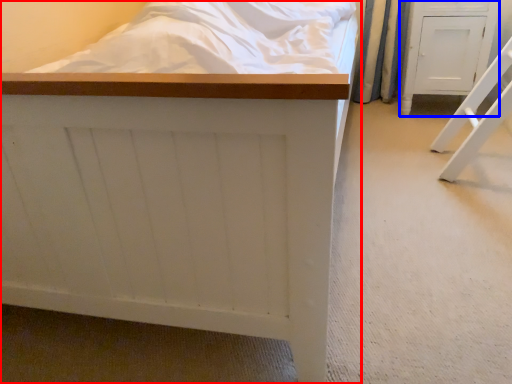
Question: Which of the following is the closest to the observer, furniture (highlighted by a red box) or furniture (highlighted by a blue box)?

Choices:
 (A) furniture
 (B) furniture

Answer: (A)